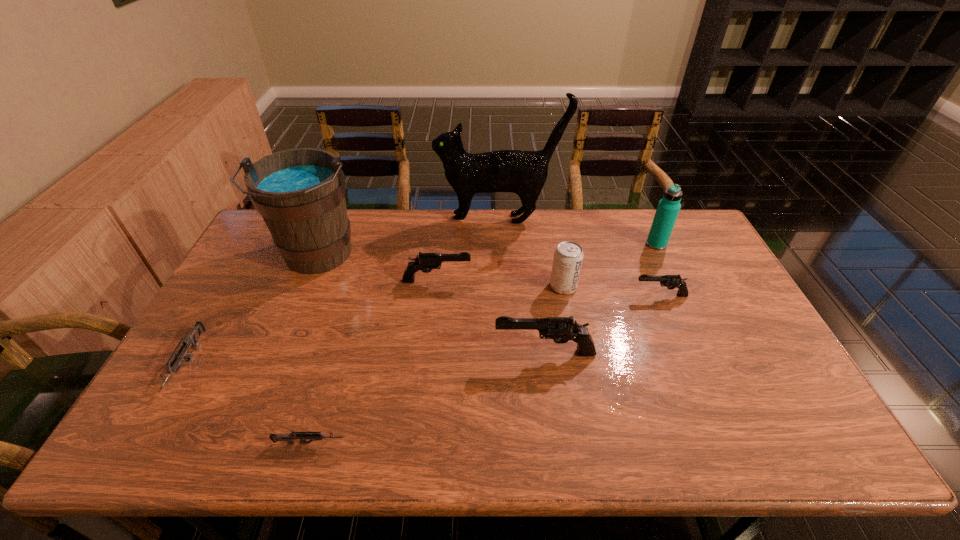
Image resolution: width=960 pixels, height=540 pixels. Find the location of `object at the far right corner`. object at the far right corner is located at coordinates (668, 208).

Identify the location of free space at the far edge of the desktop. This screenshot has height=540, width=960. click(x=643, y=249).

Identify the location of vacant region at the near edge. (720, 433).

Find the location of a particular element. The height and width of the screenshot is (540, 960). free spot at the left edge of the desktop is located at coordinates (248, 346).

In the image, there is a desktop. Where is `vacant area at the right edge`? vacant area at the right edge is located at coordinates (711, 312).

In order to click on vacant space at the far right corner of the desktop in this screenshot , I will do `click(691, 227)`.

Where is `free space between the second tallest object and the right grey gun`? The image size is (960, 540). free space between the second tallest object and the right grey gun is located at coordinates (314, 350).

This screenshot has height=540, width=960. Find the location of `free space between the rightmost black gun and the leftmost gun`. free space between the rightmost black gun and the leftmost gun is located at coordinates (424, 330).

Where is `unoccupied area between the rightmost black gun and the water bottle`? The image size is (960, 540). unoccupied area between the rightmost black gun and the water bottle is located at coordinates (659, 270).

The width and height of the screenshot is (960, 540). Identify the location of unoccupied area between the smaller grey gun and the third gun from left to right. (373, 362).